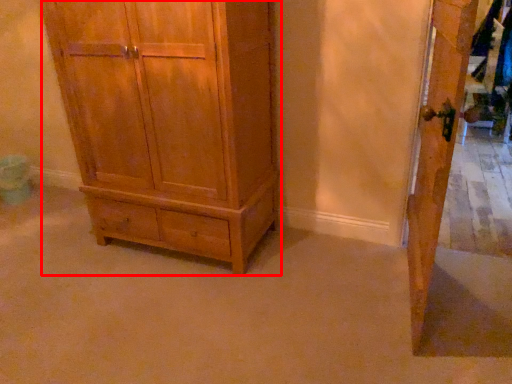
Question: From the image, what is the correct spatial relationship of chest of drawers (annotated by the red box) in relation to door?

Choices:
 (A) left
 (B) right

Answer: (A)